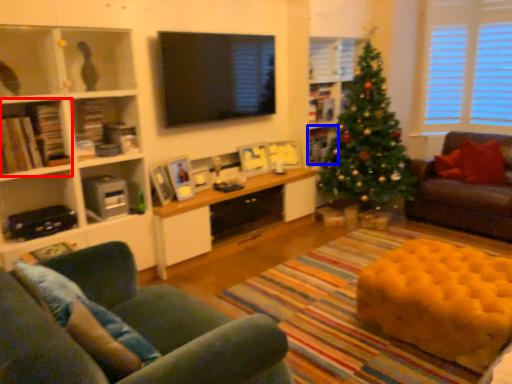
Question: Among these objects, which one is nearest to the camera, shelf (highlighted by a red box) or shelf (highlighted by a blue box)?

Choices:
 (A) shelf
 (B) shelf

Answer: (A)